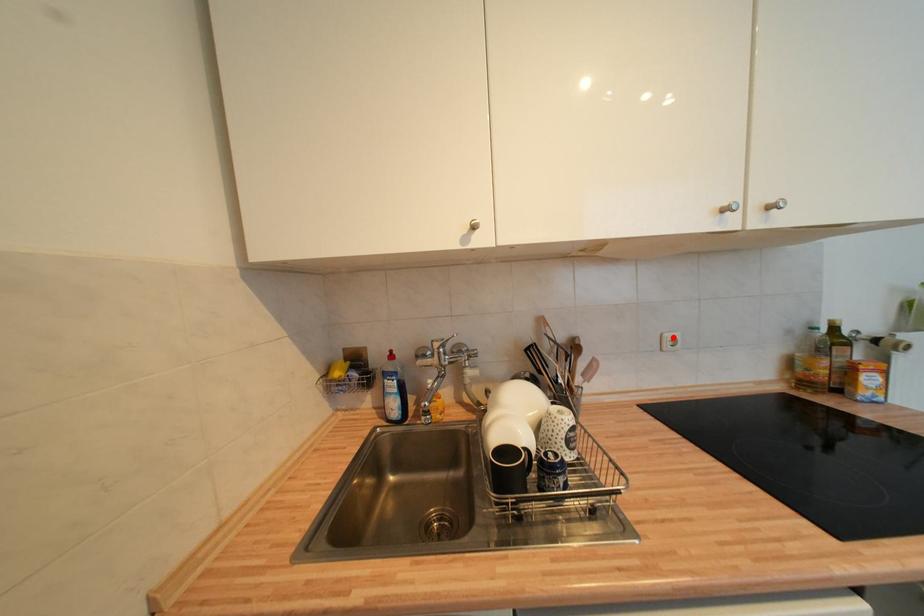
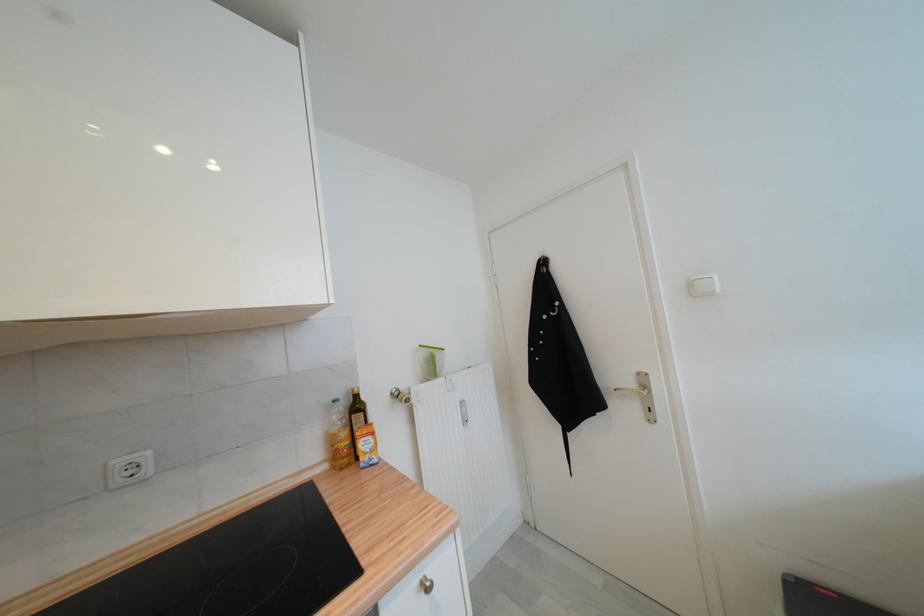
Where in the second image is the point corresponding to the highlighted location from the first image?

(126, 464)